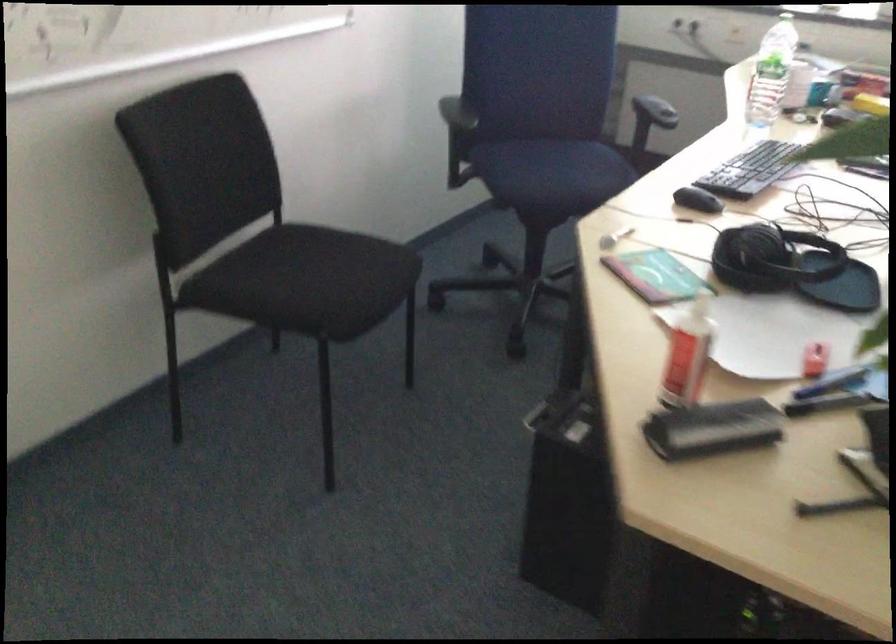
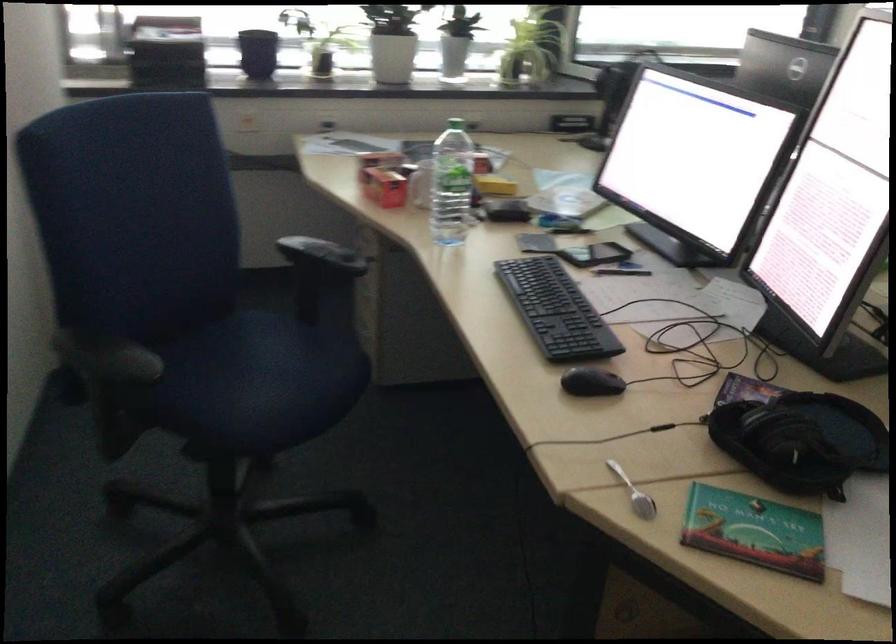
Where in the second image is the point corresponding to [607,239] from the first image?

(633, 494)